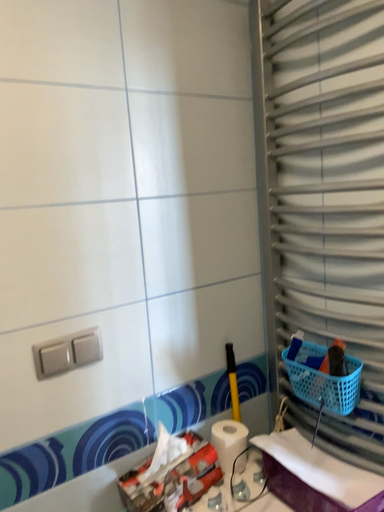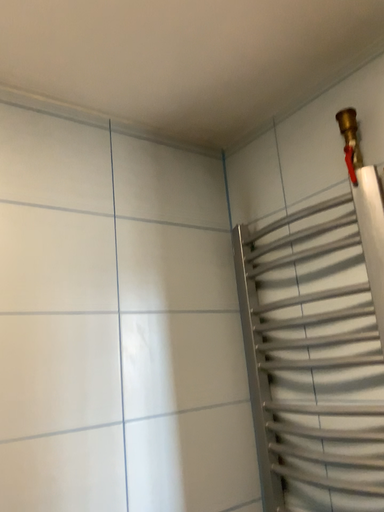
Question: How did the camera likely rotate when shooting the video?

Choices:
 (A) rotated upward
 (B) rotated downward

Answer: (A)